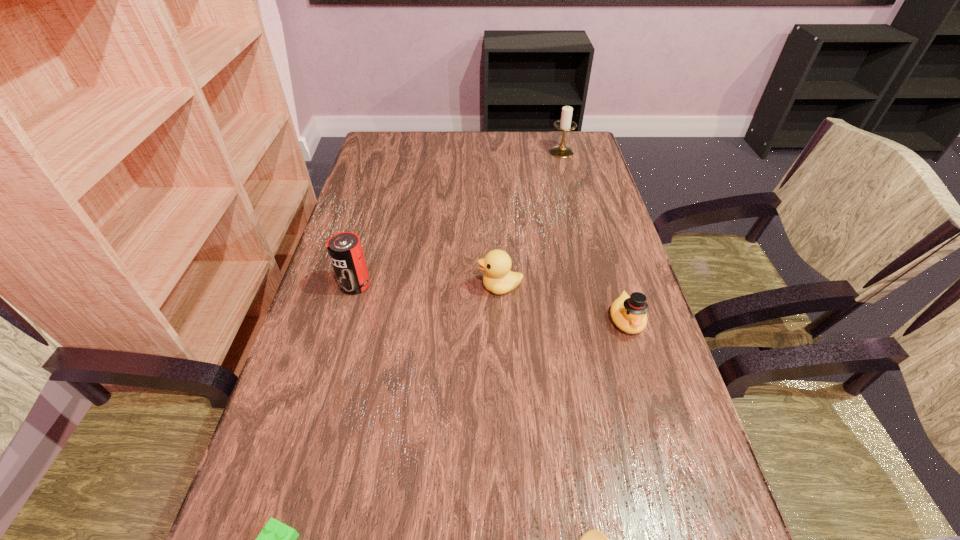
In the image, there is a desktop. Where is `free space at the far right corner`? Image resolution: width=960 pixels, height=540 pixels. free space at the far right corner is located at coordinates (573, 137).

Find the location of a particular element. free space between the farthest object and the second farthest duck is located at coordinates (594, 236).

Locate an element on the screen. Image resolution: width=960 pixels, height=540 pixels. object that is the fifth closest to the fourth farthest object is located at coordinates (276, 539).

Find the location of `object that stands as the fourth closest to the farthest object`. object that stands as the fourth closest to the farthest object is located at coordinates (594, 539).

The width and height of the screenshot is (960, 540). Identify the location of duck that is the second closest to the can. (628, 313).

Find the location of `the second closest duck relative to the nearest duck`. the second closest duck relative to the nearest duck is located at coordinates (498, 278).

Where is `free space that satisfies the following two spatial constraints: 1. on the front side of the farthest object; 2. on the face of the farthest duck`? free space that satisfies the following two spatial constraints: 1. on the front side of the farthest object; 2. on the face of the farthest duck is located at coordinates click(x=596, y=287).